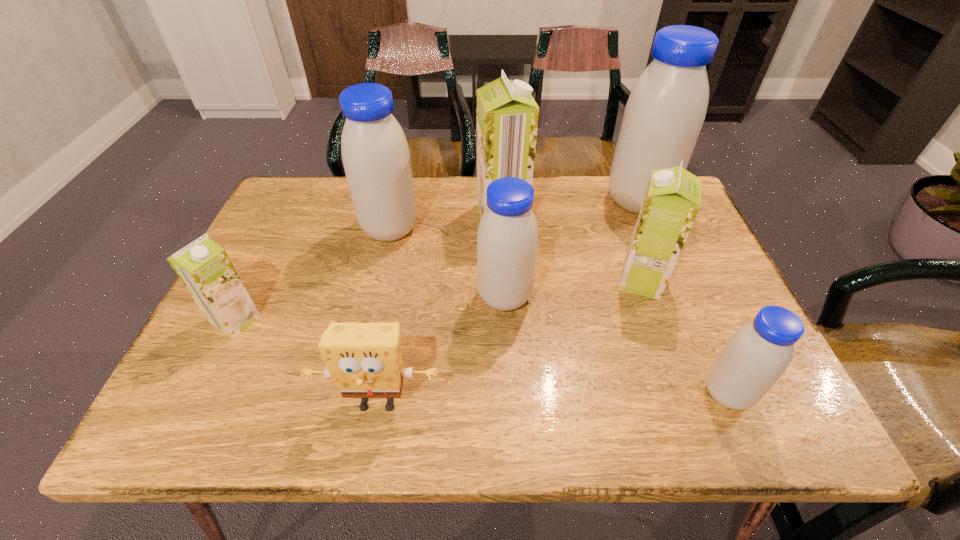
Locate an element on the screen. The image size is (960, 540). the biggest blue soya milk is located at coordinates (663, 117).

At what (x,y) coordinates should I click in order to perform the action: click on the tallest soya milk. Please return your answer as a coordinate pair (x, y). Looking at the image, I should click on (663, 117).

At what (x,y) coordinates should I click in order to perform the action: click on the leftmost blue soya milk. Please return your answer as a coordinate pair (x, y). The width and height of the screenshot is (960, 540). Looking at the image, I should click on (376, 158).

At what (x,y) coordinates should I click in order to perform the action: click on the second soya milk from left to right. Please return your answer as a coordinate pair (x, y). Image resolution: width=960 pixels, height=540 pixels. Looking at the image, I should click on (376, 158).

What are the coordinates of `the farthest green soya milk` in the screenshot? It's located at (507, 115).

Where is `the second green soya milk from right to left`? Image resolution: width=960 pixels, height=540 pixels. the second green soya milk from right to left is located at coordinates (507, 115).

Image resolution: width=960 pixels, height=540 pixels. What are the coordinates of `the rightmost green soya milk` in the screenshot? It's located at (672, 200).

Locate an element on the screen. The image size is (960, 540). the second biggest green soya milk is located at coordinates (672, 200).

At what (x,y) coordinates should I click in order to perform the action: click on the third farthest blue soya milk. Please return your answer as a coordinate pair (x, y). Looking at the image, I should click on (507, 239).

This screenshot has height=540, width=960. In order to click on the third biggest blue soya milk in this screenshot , I will do `click(507, 239)`.